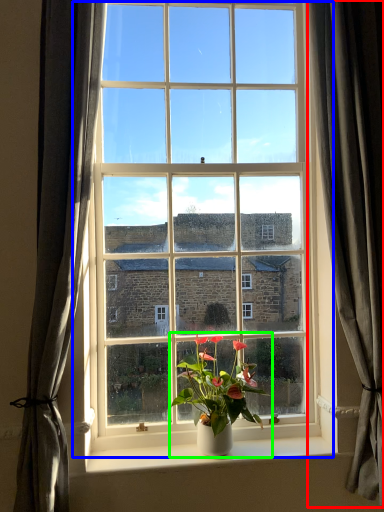
Question: Based on their relative distances, which object is nearer to curtain (highlighted by a red box)? Choose from window (highlighted by a blue box) and houseplant (highlighted by a green box).

Choices:
 (A) window
 (B) houseplant

Answer: (A)